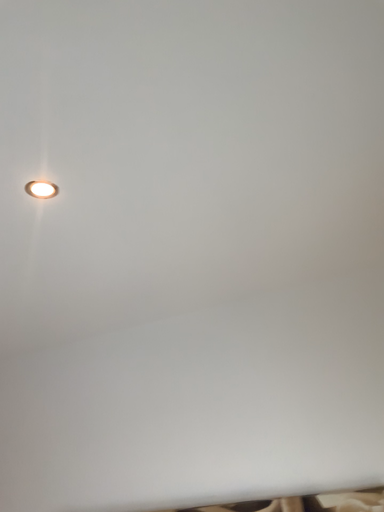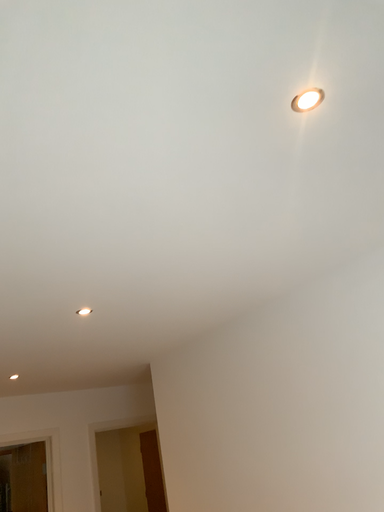
Question: How did the camera likely rotate when shooting the video?

Choices:
 (A) rotated downward
 (B) rotated upward

Answer: (A)